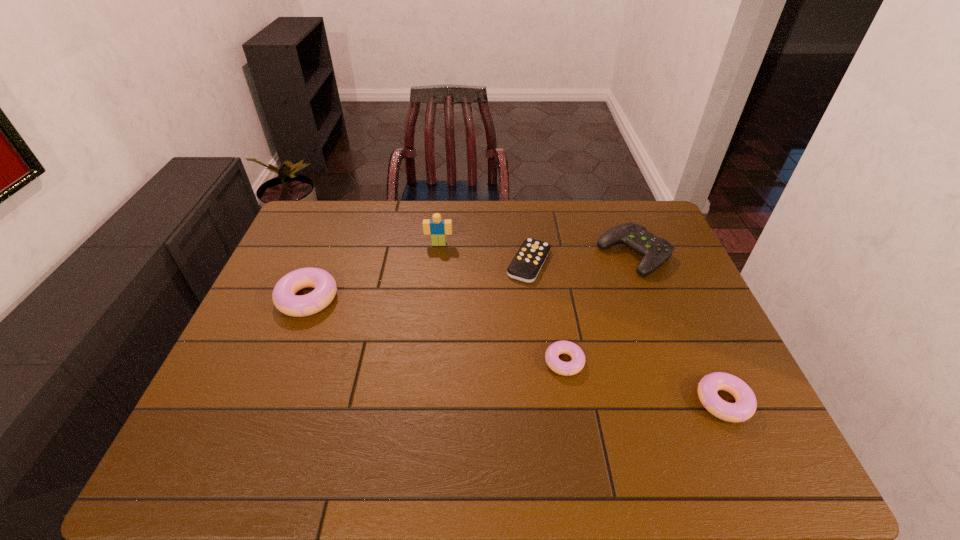
In order to click on vacant region located 0.330m on the right of the shortest doughnut in this screenshot , I will do 715,362.

Image resolution: width=960 pixels, height=540 pixels. I want to click on free spot located on the left of the second shortest doughnut, so click(611, 402).

The image size is (960, 540). What are the coordinates of `free space located 0.100m on the left of the control` in the screenshot? It's located at (566, 254).

Where is `free location located 0.060m on the right of the remote control`? free location located 0.060m on the right of the remote control is located at coordinates (571, 263).

What are the coordinates of `vacant area situated on the face of the second object from left to right` in the screenshot? It's located at (436, 271).

The height and width of the screenshot is (540, 960). I want to click on control positioned at the far edge, so click(x=655, y=250).

Where is `Lego that is at the far edge`? This screenshot has width=960, height=540. Lego that is at the far edge is located at coordinates (438, 228).

Locate an element on the screen. The width and height of the screenshot is (960, 540). object located at the near edge is located at coordinates (745, 406).

Find the location of `object present at the left edge`. object present at the left edge is located at coordinates (284, 298).

This screenshot has width=960, height=540. I want to click on doughnut that is at the right edge, so click(x=745, y=406).